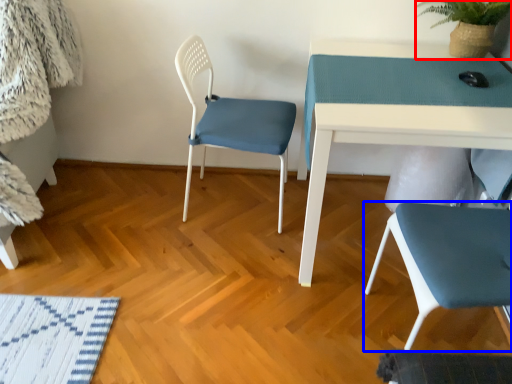
Question: Which point is closer to the camera, plant (highlighted by a red box) or chair (highlighted by a blue box)?

Choices:
 (A) plant
 (B) chair

Answer: (B)